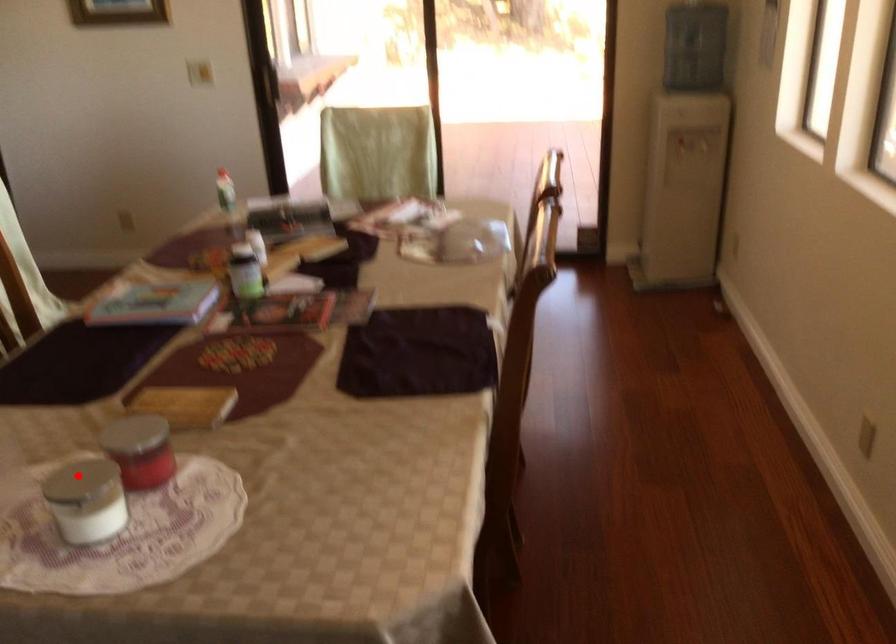
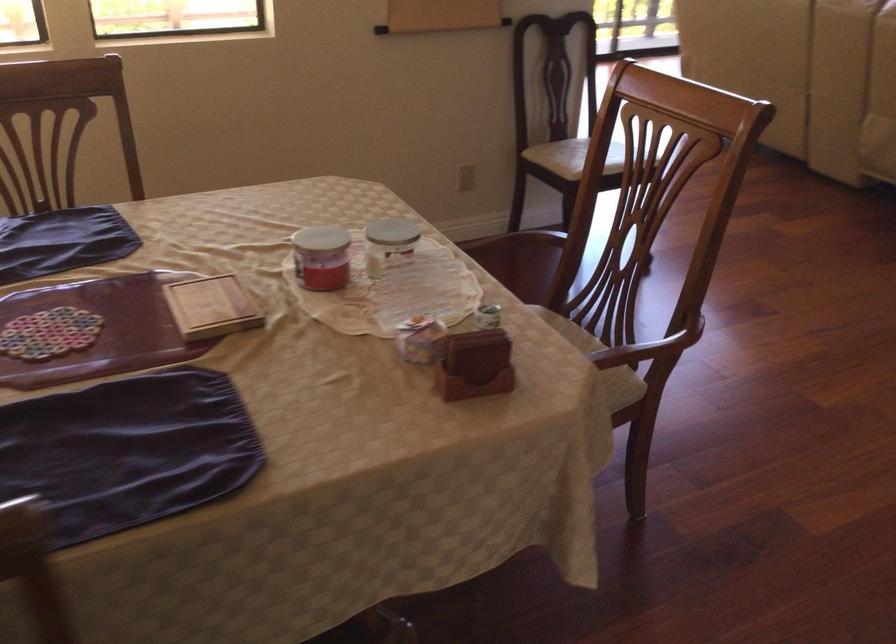
Question: I am providing you with two images of the same scene from different viewpoints. A red point is shown in image1. For the corresponding object point in image2, is it positioned nearer or farther from the camera?

Choices:
 (A) Nearer
 (B) Farther

Answer: (B)